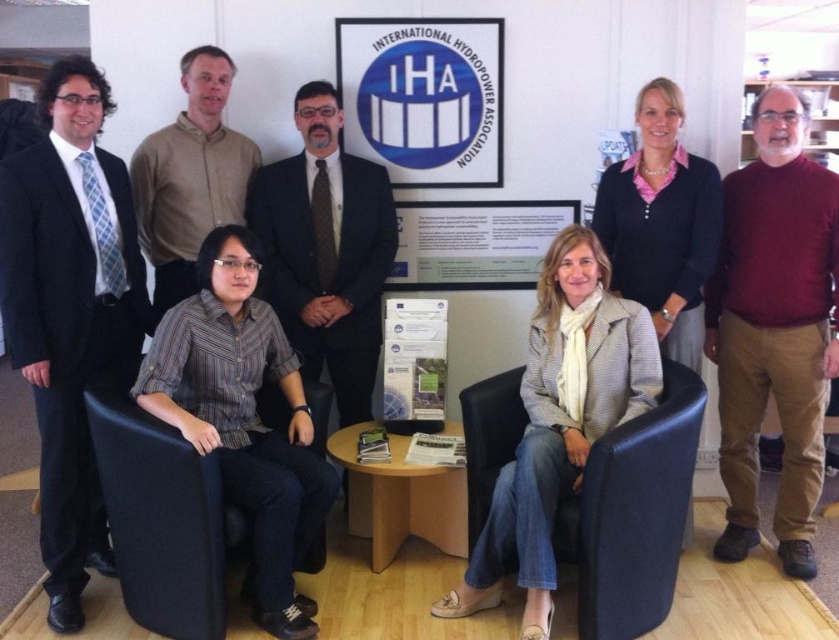
You are a photographer setting up for a group photo in the office. You need to ensure that all subjects are visible. The black fabric armchair at lower left and the white paper at center are in the frame. Which object is taller, requiring you to adjust your camera angle to include both?

The black fabric armchair at lower left is much taller than the white paper at center, so you should adjust the camera angle to account for its height to ensure both are fully visible.

You are organizing a photo shoot and need to ensure that all items in the scene are properly sized for the camera frame. Given the maroon sweater at right and the black fabric armchair at lower left, which object would require more space in the camera frame due to its size?

The maroon sweater at right requires more space in the camera frame because it is bigger than the black fabric armchair at lower left.

You are a photographer adjusting your camera settings to focus on two specific points in the image. The first point is at coordinates point (326, 112) and the second is at point (155, 515). Which point should you focus on first if you want to ensure both points are in sharp focus?

You should focus on point (326, 112) first because it is closer to the camera than point (155, 515), ensuring that both points will be within the depth of field when focused on the closer point.